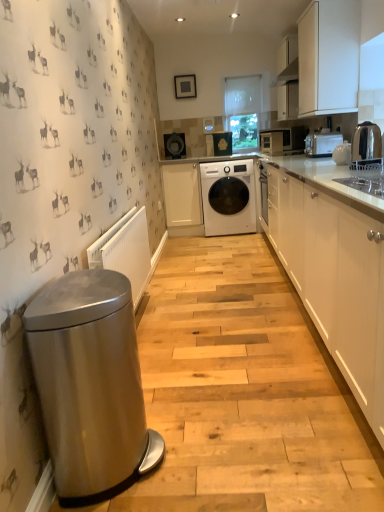
Image resolution: width=384 pixels, height=512 pixels. I want to click on vacant point to the right of white plastic radiator at lower left, so click(x=217, y=323).